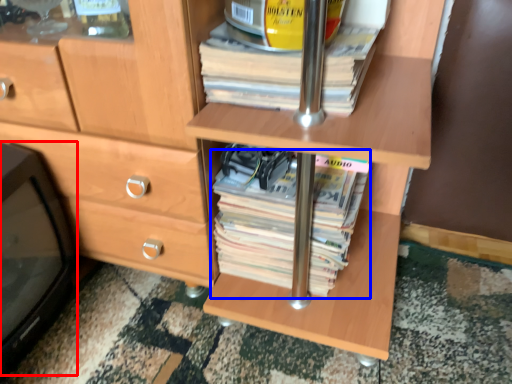
Question: Which point is further to the camera, desktop (highlighted by a red box) or paperback book (highlighted by a blue box)?

Choices:
 (A) desktop
 (B) paperback book

Answer: (B)